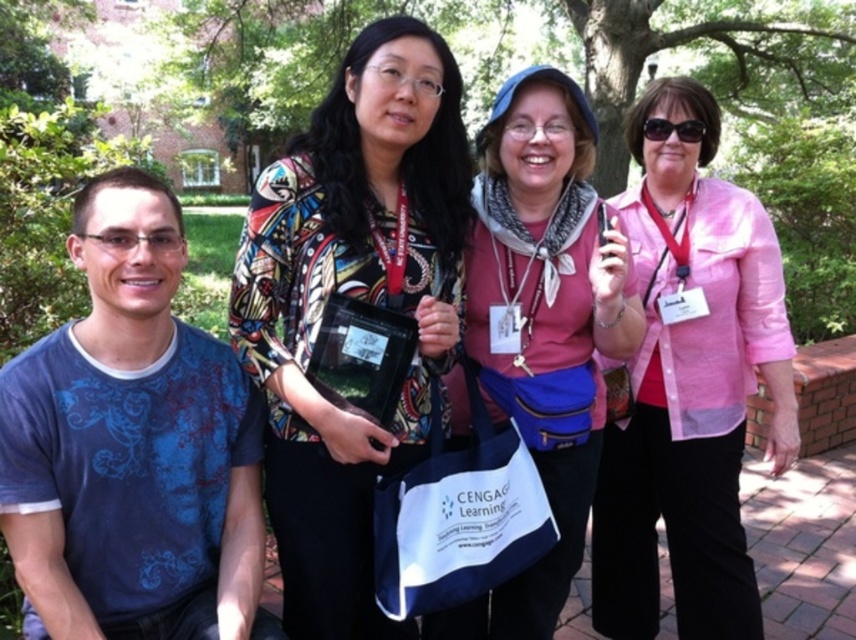
Who is positioned more to the left, blue printed t-shirt at left or pink sheer blouse at center?

Positioned to the left is blue printed t-shirt at left.

Where is `blue printed t-shirt at left`? The height and width of the screenshot is (640, 856). blue printed t-shirt at left is located at coordinates (132, 445).

What are the coordinates of `blue printed t-shirt at left` in the screenshot? It's located at (132, 445).

Can you confirm if black plastic bag at center is wider than black plastic sunglasses at upper center?

Correct, the width of black plastic bag at center exceeds that of black plastic sunglasses at upper center.

Is point (412, 355) positioned before point (648, 125)?

Yes.

Who is more forward, (382, 387) or (649, 129)?

Point (382, 387) is more forward.

The height and width of the screenshot is (640, 856). In order to click on black plastic bag at center in this screenshot , I will do `click(361, 355)`.

Is blue printed t-shirt at left to the right of black plastic sunglasses at upper center from the viewer's perspective?

Incorrect, blue printed t-shirt at left is not on the right side of black plastic sunglasses at upper center.

Is blue printed t-shirt at left wider than black plastic sunglasses at upper center?

Indeed, blue printed t-shirt at left has a greater width compared to black plastic sunglasses at upper center.

Locate an element on the screen. blue printed t-shirt at left is located at coordinates pyautogui.click(x=132, y=445).

Find the location of a particular element. blue printed t-shirt at left is located at coordinates (132, 445).